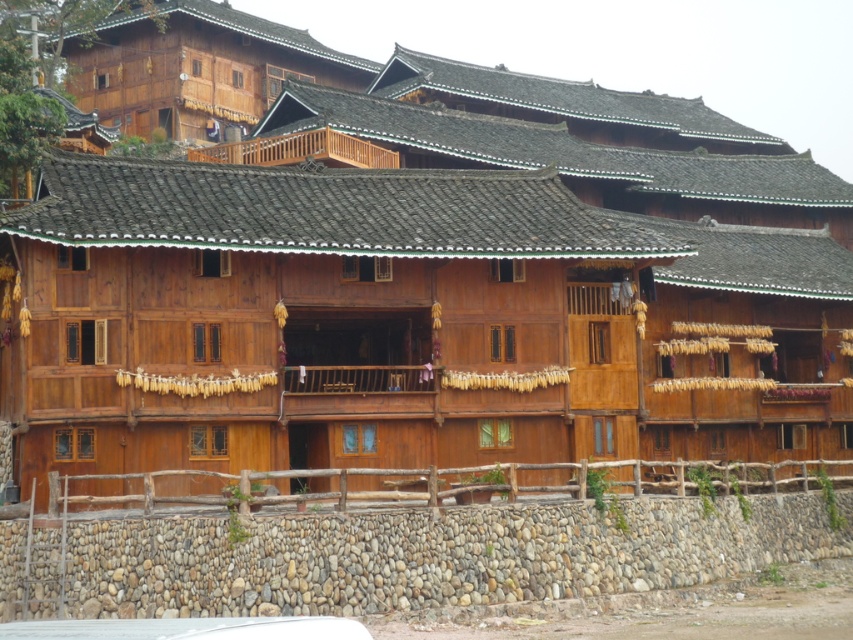
You are standing in front of the building and want to park your white matte car at lower center. There is a natural wood balcony at upper center above it. Is there enough vertical space between the car and the balcony for a person to walk underneath?

The white matte car at lower center is below the natural wood balcony at upper center. Since the balcony is positioned above the car, there should be sufficient vertical clearance for a person to walk underneath without any issues.

What are the coordinates of the white matte car at lower center?

The white matte car at lower center is located at coordinates point (190, 628).